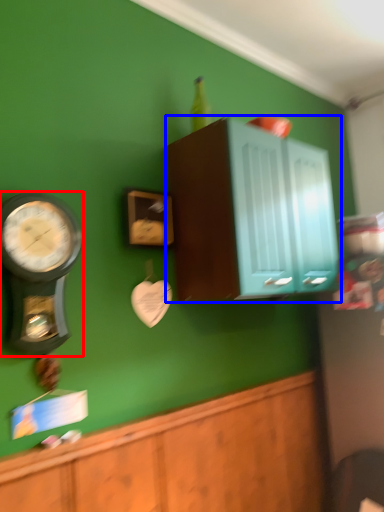
Question: Which object appears closest to the camera in this image, wall clock (highlighted by a red box) or cabinetry (highlighted by a blue box)?

Choices:
 (A) wall clock
 (B) cabinetry

Answer: (A)